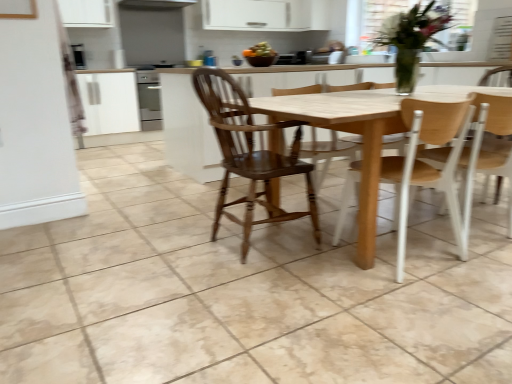
This screenshot has height=384, width=512. I want to click on free space in front of wooden chair at center, which is the 2th chair from right to left, so click(416, 298).